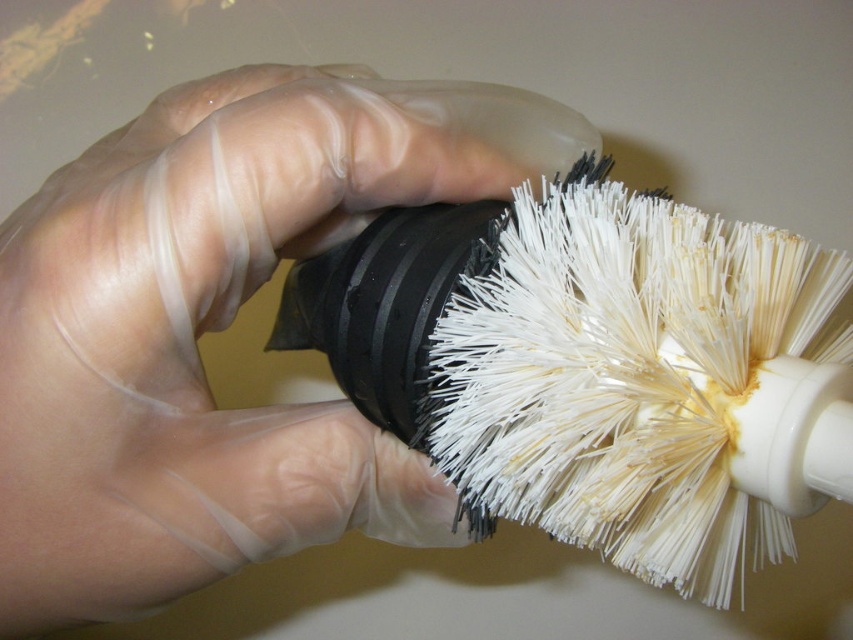
You are a kitchen assistant who needs to clean a small sink drain. You have a transparent plastic glove at center and a white bristle brush at center. Which tool should you use to scrub the drain, and why?

You should use the white bristle brush at center because the transparent plastic glove at center is smaller and may not provide enough surface area or stiffness to effectively scrub the drain.

You are a photographer trying to capture a close detail of the transparent plastic glove at center. Your camera requires the subject to be at least 20 inches away to focus properly. Based on the scene description, will the glove be in focus?

The transparent plastic glove at center is 18.39 inches away from camera, which is closer than the minimum required distance of 20 inches. Therefore, the glove will not be in focus.

You are a kitchen assistant who needs to clean a narrow sink drain. You have a transparent plastic glove at center and a white bristle brush at center. Which object is taller and can better reach into the drain?

The transparent plastic glove at center is much taller than the white bristle brush at center, so it can better reach into the narrow sink drain.